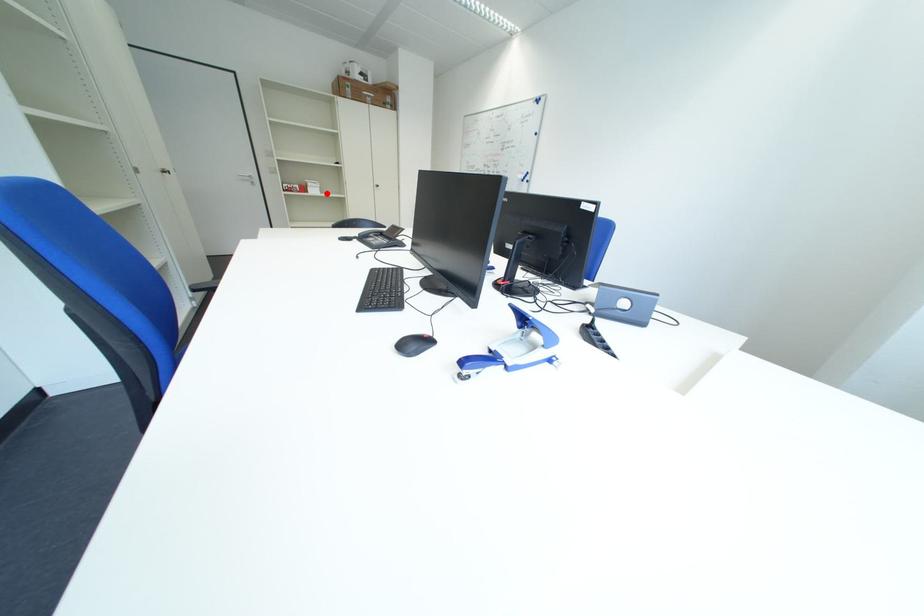
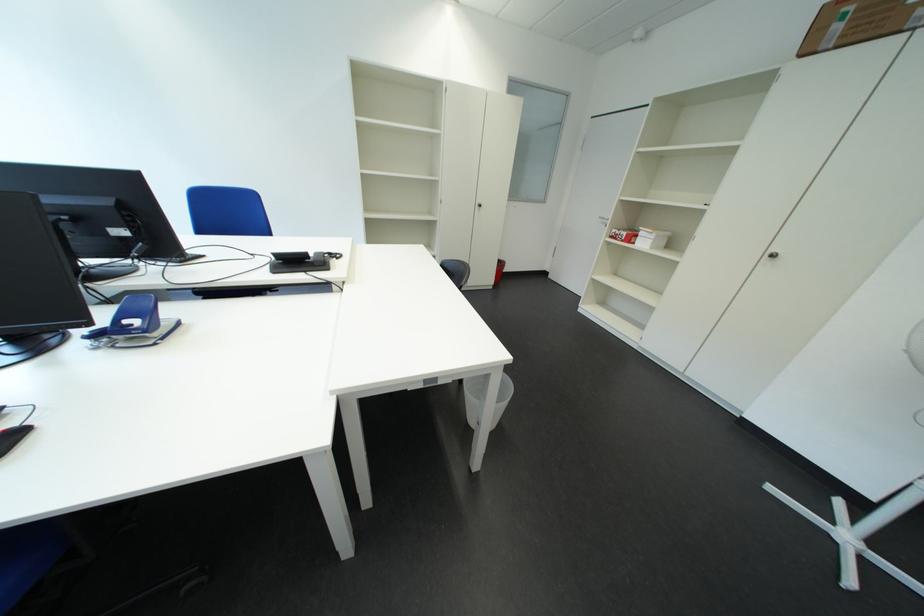
Find the pixel in the second image that matches the highlighted location in the first image.

(657, 246)